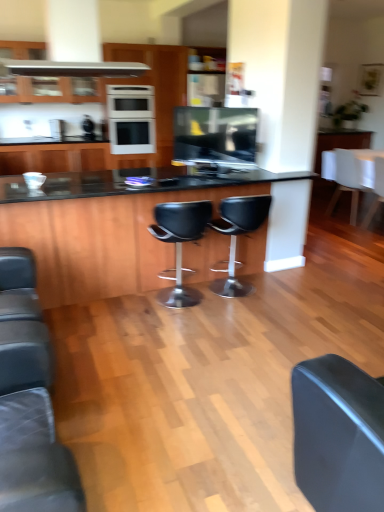
Locate an element on the screen. The image size is (384, 512). free spot to the left of black leather stool at center, which ranks as the fourth chair in back-to-front order is located at coordinates (122, 312).